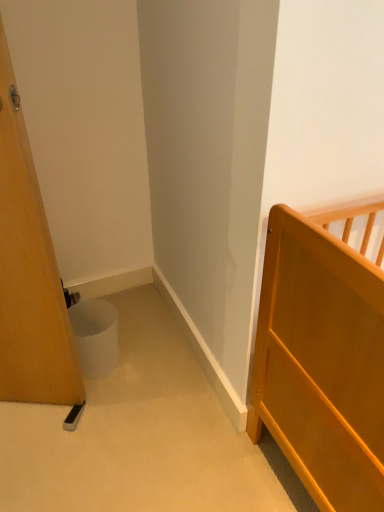
Find the location of `vacant area located to the right-hand side of white matte potty at lower left`. vacant area located to the right-hand side of white matte potty at lower left is located at coordinates coord(138,357).